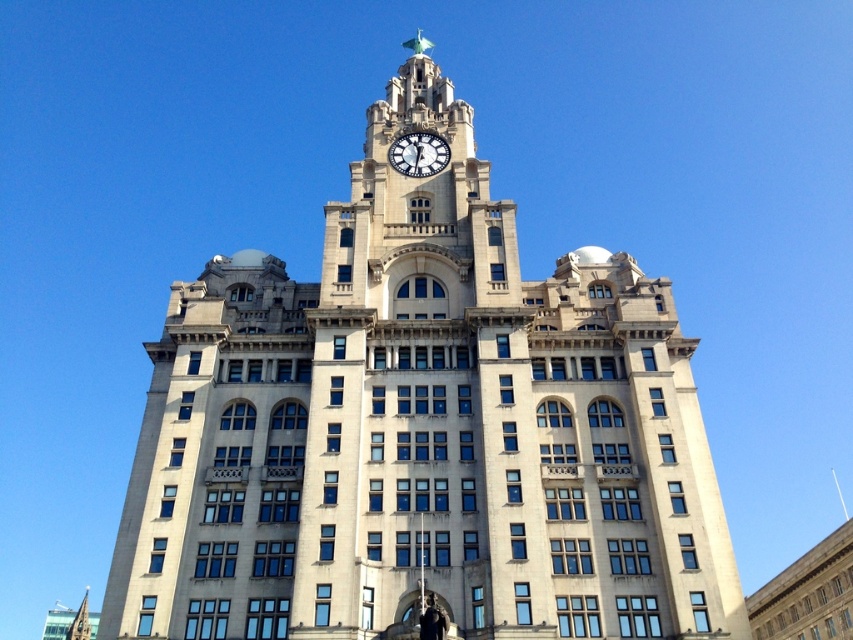
This screenshot has height=640, width=853. What do you see at coordinates (422, 429) in the screenshot?
I see `white stone clock tower at center` at bounding box center [422, 429].

Does point (698, 534) come farther from viewer compared to point (409, 148)?

No, (698, 534) is closer to viewer.

Which is in front, point (531, 426) or point (434, 141)?

Point (531, 426)

Where is `white stone clock tower at center`? The height and width of the screenshot is (640, 853). white stone clock tower at center is located at coordinates click(x=422, y=429).